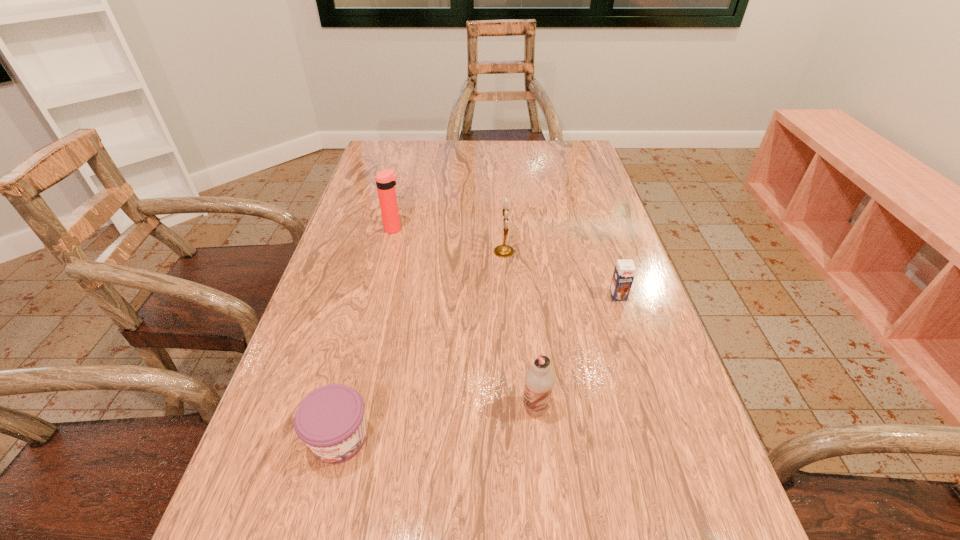
The image size is (960, 540). Find the location of `the farthest object`. the farthest object is located at coordinates (386, 180).

At what (x,y) coordinates should I click in order to perform the action: click on the second farthest object. Please return your answer as a coordinate pair (x, y). The image size is (960, 540). Looking at the image, I should click on (504, 251).

The image size is (960, 540). I want to click on the nearer chocolate milk, so click(x=539, y=380).

Where is `the taller chocolate milk`? The height and width of the screenshot is (540, 960). the taller chocolate milk is located at coordinates (539, 380).

The width and height of the screenshot is (960, 540). What are the coordinates of `the right chocolate milk` in the screenshot? It's located at (625, 270).

Locate an element on the screen. This screenshot has height=540, width=960. the shorter chocolate milk is located at coordinates (625, 270).

This screenshot has height=540, width=960. What are the coordinates of `jam` in the screenshot? It's located at (330, 420).

In order to click on free region located on the front of the farthest object in this screenshot , I will do `click(385, 266)`.

Image resolution: width=960 pixels, height=540 pixels. In order to click on free space located 0.370m on the front of the candelabrum in this screenshot , I will do `click(513, 392)`.

Image resolution: width=960 pixels, height=540 pixels. In order to click on free space located on the back of the nearer chocolate milk in this screenshot , I will do `click(522, 275)`.